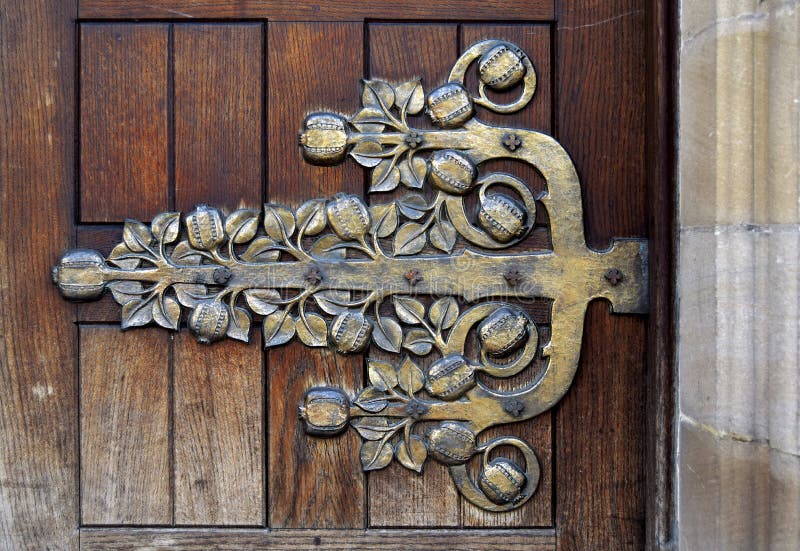
Locate an element on the screen. The image size is (800, 551). white bricks is located at coordinates (737, 368), (709, 36).